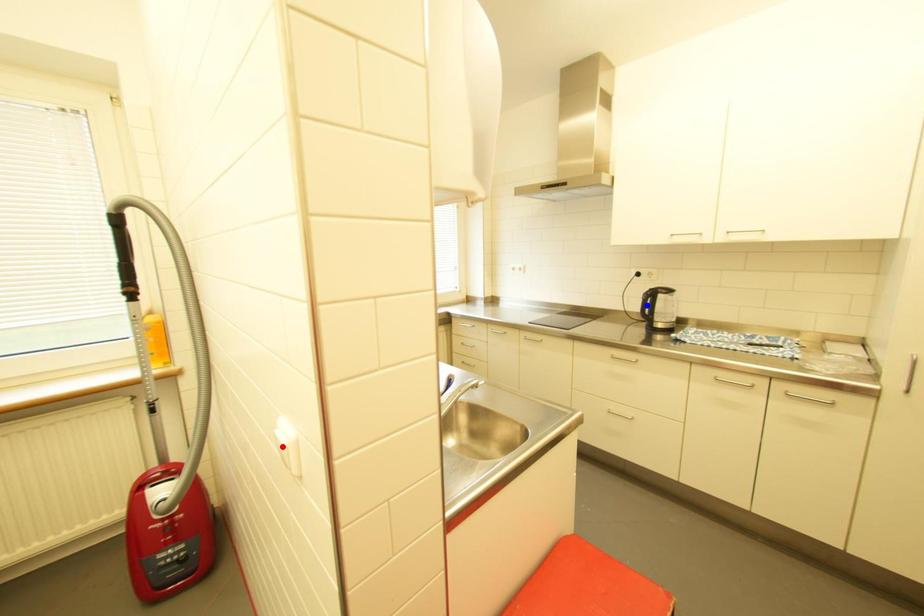
Question: Two points are marked on the image. Which point is closer to the camera?

Choices:
 (A) Blue point is closer.
 (B) Red point is closer.

Answer: (B)